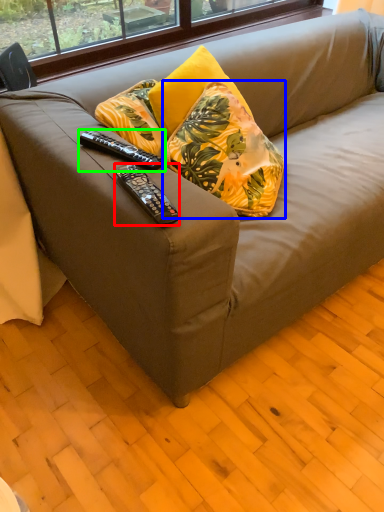
Question: Which is nearer to the remote control (highlighted by a red box)? pillow (highlighted by a blue box) or remote control (highlighted by a green box).

Choices:
 (A) pillow
 (B) remote control

Answer: (B)